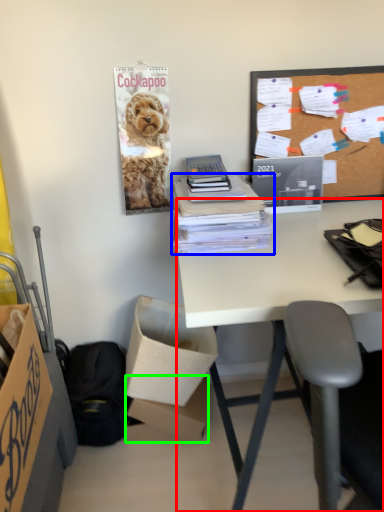
Question: Based on their relative distances, which object is farther from desk (highlighted by a red box)? Choose from office supplies (highlighted by a blue box) and box (highlighted by a green box).

Choices:
 (A) office supplies
 (B) box

Answer: (B)